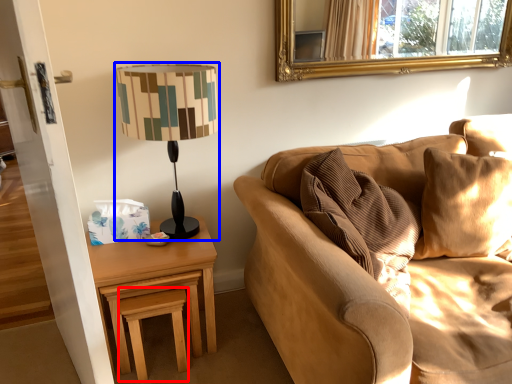
Question: Which of the following is the farthest to the observer, stool (highlighted by a red box) or lamp (highlighted by a blue box)?

Choices:
 (A) stool
 (B) lamp

Answer: (A)